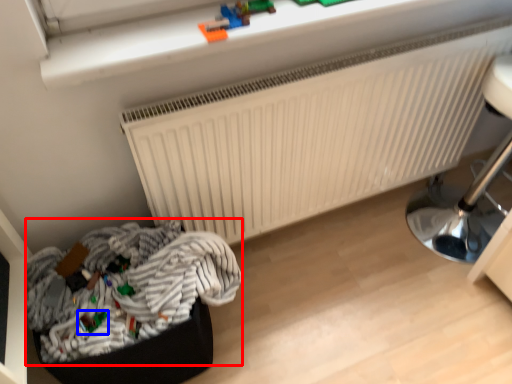
Question: Which object is further to the camera taking this photo, laundry (highlighted by a red box) or toy (highlighted by a blue box)?

Choices:
 (A) laundry
 (B) toy

Answer: (B)